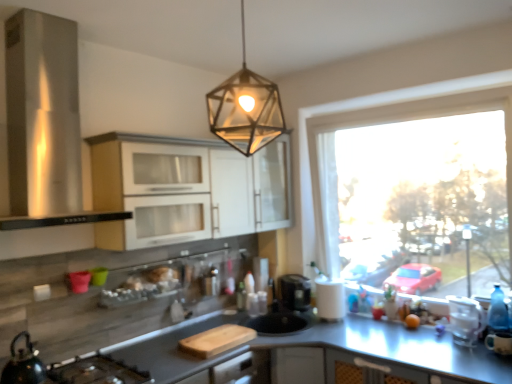
Question: Is transparent glass window at right bigger than stainless steel range hood at left?

Choices:
 (A) no
 (B) yes

Answer: (B)

Question: Is transparent glass window at right at the left side of stainless steel range hood at left?

Choices:
 (A) yes
 (B) no

Answer: (B)

Question: From the image's perspective, is transparent glass window at right located beneath stainless steel range hood at left?

Choices:
 (A) no
 (B) yes

Answer: (B)

Question: Can you confirm if transparent glass window at right is taller than stainless steel range hood at left?

Choices:
 (A) yes
 (B) no

Answer: (A)

Question: Can you confirm if transparent glass window at right is smaller than stainless steel range hood at left?

Choices:
 (A) no
 (B) yes

Answer: (A)

Question: From a real-world perspective, relative to stainless steel range hood at left, is metallic hexagonal light fixture at upper center vertically above or below?

Choices:
 (A) below
 (B) above

Answer: (B)

Question: From the image's perspective, is metallic hexagonal light fixture at upper center located above or below stainless steel range hood at left?

Choices:
 (A) above
 (B) below

Answer: (A)

Question: Considering the relative positions of metallic hexagonal light fixture at upper center and stainless steel range hood at left in the image provided, is metallic hexagonal light fixture at upper center to the left or to the right of stainless steel range hood at left?

Choices:
 (A) right
 (B) left

Answer: (A)

Question: In terms of size, does metallic hexagonal light fixture at upper center appear bigger or smaller than stainless steel range hood at left?

Choices:
 (A) small
 (B) big

Answer: (A)

Question: Considering the positions of point (197, 193) and point (339, 281), is point (197, 193) closer or farther from the camera than point (339, 281)?

Choices:
 (A) closer
 (B) farther

Answer: (A)

Question: From their relative heights in the image, would you say white glossy cabinets at upper center, the second cabinetry positioned from the back, is taller or shorter than white matte paper towel at right?

Choices:
 (A) tall
 (B) short

Answer: (A)

Question: Considering their positions, is white glossy cabinets at upper center, the second cabinetry positioned from the back, located in front of or behind white matte paper towel at right?

Choices:
 (A) front
 (B) behind

Answer: (A)

Question: Based on their sizes in the image, would you say white glossy cabinets at upper center, marked as the 1th cabinetry in a front-to-back arrangement, is bigger or smaller than white matte paper towel at right?

Choices:
 (A) big
 (B) small

Answer: (A)

Question: Is metallic hexagonal light fixture at upper center taller or shorter than matte white cabinet at upper center, which is the 1th cabinetry from back to front?

Choices:
 (A) tall
 (B) short

Answer: (B)

Question: Is metallic hexagonal light fixture at upper center situated inside matte white cabinet at upper center, positioned as the second cabinetry in front-to-back order, or outside?

Choices:
 (A) inside
 (B) outside

Answer: (B)